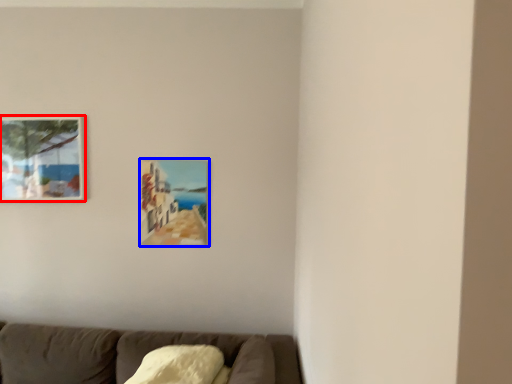
Question: Which of the following is the farthest to the observer, picture frame (highlighted by a red box) or picture frame (highlighted by a blue box)?

Choices:
 (A) picture frame
 (B) picture frame

Answer: (B)